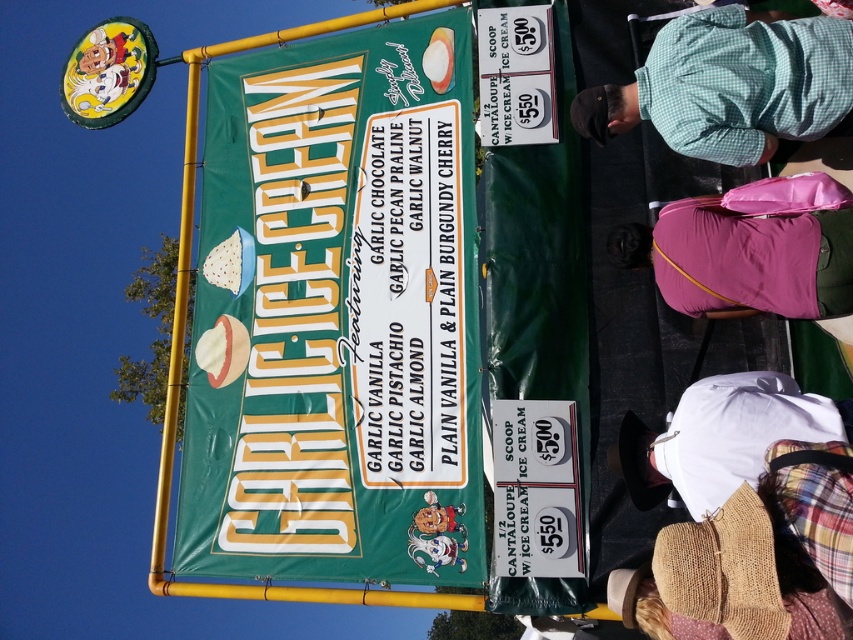
Question: Which is nearer to the green fabric banner at upper center?

Choices:
 (A) white cotton shirt at lower right
 (B) purple fabric bag at lower right
 (C) green checkered shirt at upper right

Answer: (B)

Question: Can you confirm if purple fabric bag at lower right is bigger than white cotton shirt at lower right?

Choices:
 (A) no
 (B) yes

Answer: (A)

Question: Which object is the closest to the green fabric banner at upper center?

Choices:
 (A) green checkered shirt at upper right
 (B) white cotton shirt at lower right

Answer: (B)

Question: Is green fabric banner at upper center to the right of white cotton shirt at lower right from the viewer's perspective?

Choices:
 (A) no
 (B) yes

Answer: (A)

Question: Can you confirm if green fabric banner at upper center is positioned above white cotton shirt at lower right?

Choices:
 (A) yes
 (B) no

Answer: (A)

Question: Which point is closer to the camera?

Choices:
 (A) purple fabric bag at lower right
 (B) green checkered shirt at upper right
 (C) green fabric banner at upper center
 (D) white cotton shirt at lower right

Answer: (D)